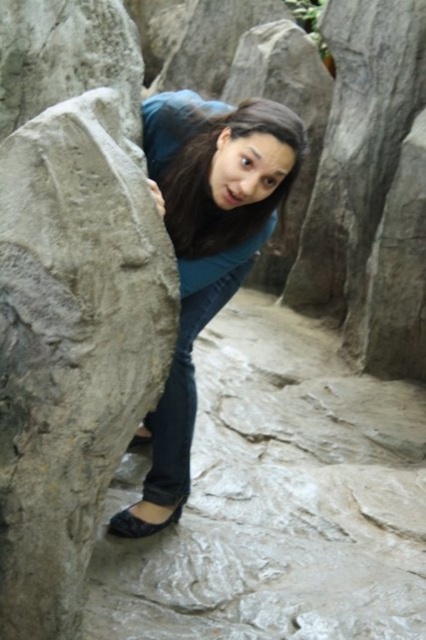
You are a photographer trying to capture the person in the image. You notice a point at coordinates (207,241). What object is located at this point?

The point at coordinates (207,241) marks the blue matte shirt at center.

You are a photographer trying to capture the person in the scene. You notice the brown matte hair at center and the black leather sandal at lower left. Which object is positioned to the right of the other?

The brown matte hair at center is to the right of the black leather sandal at lower left.

You are a photographer trying to capture the blue matte shirt at center and the black leather sandal at lower left in the same frame. Based on their positions, which object should you adjust your camera to focus on first to ensure both are in the shot?

The black leather sandal at lower left should be focused on first since the blue matte shirt at center is to the right of it, allowing the camera to capture both by adjusting from the left to the right.